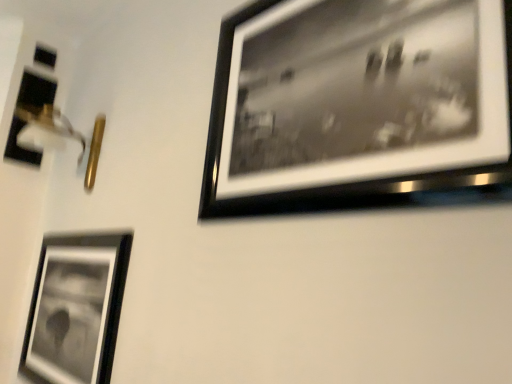
Measure the distance between point (64, 309) and camera.

The depth of point (64, 309) is 5.35 feet.

Find the location of a particular element. black matte picture frame at upper right, arranged as the 3th picture frame when viewed from the left is located at coordinates (357, 103).

Which of these two, matte black picture frame at left, arranged as the first picture frame when viewed from the back, or metallic silver frame at lower left, placed as the second picture frame when sorted from left to right, is thinner?

metallic silver frame at lower left, placed as the second picture frame when sorted from left to right, is thinner.

What are the coordinates of `the 2nd picture frame positioned above the metallic silver frame at lower left, marked as the second picture frame in a back-to-front arrangement (from a real-world perspective)` in the screenshot? It's located at (36, 91).

Which object is further away from the camera taking this photo, matte black picture frame at left, arranged as the 1th picture frame when viewed from the left, or metallic silver frame at lower left, placed as the second picture frame when sorted from left to right?

matte black picture frame at left, arranged as the 1th picture frame when viewed from the left, is more distant.

Consider the image. Is metallic silver frame at lower left, positioned as the second picture frame in right-to-left order, inside black matte picture frame at upper right, the 1th picture frame viewed from the right?

No, metallic silver frame at lower left, positioned as the second picture frame in right-to-left order, is not inside black matte picture frame at upper right, the 1th picture frame viewed from the right.

Looking at the image, does black matte picture frame at upper right, which ranks as the first picture frame in front-to-back order, seem bigger or smaller compared to metallic silver frame at lower left, placed as the second picture frame when sorted from left to right?

In the image, black matte picture frame at upper right, which ranks as the first picture frame in front-to-back order, appears to be smaller than metallic silver frame at lower left, placed as the second picture frame when sorted from left to right.

Measure the distance between black matte picture frame at upper right, arranged as the 3th picture frame when viewed from the left, and metallic silver frame at lower left, the second picture frame when ordered from front to back.

black matte picture frame at upper right, arranged as the 3th picture frame when viewed from the left, and metallic silver frame at lower left, the second picture frame when ordered from front to back, are 83.78 centimeters apart from each other.

Is black matte picture frame at upper right, arranged as the 3th picture frame when viewed from the left, facing towards metallic silver frame at lower left, marked as the second picture frame in a back-to-front arrangement?

No, black matte picture frame at upper right, arranged as the 3th picture frame when viewed from the left, is not aimed at metallic silver frame at lower left, marked as the second picture frame in a back-to-front arrangement.

How many degrees apart are the facing directions of matte black picture frame at left, positioned as the third picture frame in front-to-back order, and black matte picture frame at upper right, which ranks as the third picture frame in back-to-front order?

They differ by 88.5 degrees in their facing directions.

Is matte black picture frame at left, the third picture frame viewed from the right, spatially inside black matte picture frame at upper right, arranged as the 3th picture frame when viewed from the left, or outside of it?

matte black picture frame at left, the third picture frame viewed from the right, is not enclosed by black matte picture frame at upper right, arranged as the 3th picture frame when viewed from the left.

Between point (34, 162) and point (445, 155), which one is positioned behind?

Point (34, 162)

Identify the location of the 2nd picture frame behind the black matte picture frame at upper right, which ranks as the third picture frame in back-to-front order. (36, 91).

Is metallic silver frame at lower left, positioned as the second picture frame in right-to-left order, spatially inside matte black picture frame at left, the third picture frame viewed from the right, or outside of it?

metallic silver frame at lower left, positioned as the second picture frame in right-to-left order, is outside matte black picture frame at left, the third picture frame viewed from the right.

Find the location of `picture frame to the left of metallic silver frame at lower left, placed as the second picture frame when sorted from left to right`. picture frame to the left of metallic silver frame at lower left, placed as the second picture frame when sorted from left to right is located at coordinates (36, 91).

From a real-world perspective, is metallic silver frame at lower left, placed as the second picture frame when sorted from left to right, positioned above or below matte black picture frame at left, arranged as the 1th picture frame when viewed from the left?

metallic silver frame at lower left, placed as the second picture frame when sorted from left to right, is situated lower than matte black picture frame at left, arranged as the 1th picture frame when viewed from the left, in the real world.

Is metallic silver frame at lower left, placed as the second picture frame when sorted from left to right, positioned before matte black picture frame at left, arranged as the 1th picture frame when viewed from the left?

Yes, metallic silver frame at lower left, placed as the second picture frame when sorted from left to right, is closer to the camera.

Considering the relative sizes of metallic silver frame at lower left, the second picture frame when ordered from front to back, and black matte picture frame at upper right, which ranks as the third picture frame in back-to-front order, in the image provided, is metallic silver frame at lower left, the second picture frame when ordered from front to back, shorter than black matte picture frame at upper right, which ranks as the third picture frame in back-to-front order,?

Indeed, metallic silver frame at lower left, the second picture frame when ordered from front to back, has a lesser height compared to black matte picture frame at upper right, which ranks as the third picture frame in back-to-front order.

From a real-world perspective, who is located lower, metallic silver frame at lower left, positioned as the second picture frame in right-to-left order, or black matte picture frame at upper right, which ranks as the first picture frame in front-to-back order?

From a 3D spatial view, metallic silver frame at lower left, positioned as the second picture frame in right-to-left order, is below.

This screenshot has width=512, height=384. What are the coordinates of `picture frame below the black matte picture frame at upper right, which ranks as the third picture frame in back-to-front order (from a real-world perspective)` in the screenshot? It's located at (76, 308).

Are metallic silver frame at lower left, positioned as the second picture frame in right-to-left order, and black matte picture frame at upper right, which ranks as the first picture frame in front-to-back order, located far from each other?

metallic silver frame at lower left, positioned as the second picture frame in right-to-left order, is actually quite close to black matte picture frame at upper right, which ranks as the first picture frame in front-to-back order.

From the image's perspective, is black matte picture frame at upper right, which ranks as the first picture frame in front-to-back order, above or below matte black picture frame at left, positioned as the third picture frame in front-to-back order?

From the image's perspective, black matte picture frame at upper right, which ranks as the first picture frame in front-to-back order, appears below matte black picture frame at left, positioned as the third picture frame in front-to-back order.

Is black matte picture frame at upper right, arranged as the 3th picture frame when viewed from the left, turned away from matte black picture frame at left, the third picture frame viewed from the right?

black matte picture frame at upper right, arranged as the 3th picture frame when viewed from the left, does not have its back to matte black picture frame at left, the third picture frame viewed from the right.

Measure the distance from black matte picture frame at upper right, arranged as the 3th picture frame when viewed from the left, to matte black picture frame at left, the third picture frame viewed from the right.

black matte picture frame at upper right, arranged as the 3th picture frame when viewed from the left, and matte black picture frame at left, the third picture frame viewed from the right, are 1.68 meters apart.

Is matte black picture frame at left, the third picture frame viewed from the right, located within black matte picture frame at upper right, which ranks as the third picture frame in back-to-front order?

→ That's incorrect, matte black picture frame at left, the third picture frame viewed from the right, is not inside black matte picture frame at upper right, which ranks as the third picture frame in back-to-front order.

This screenshot has width=512, height=384. Identify the location of picture frame that is the 1st object to the right of the matte black picture frame at left, positioned as the third picture frame in front-to-back order, starting at the anchor. (76, 308).

Locate an element on the screen. This screenshot has width=512, height=384. picture frame below the black matte picture frame at upper right, which ranks as the third picture frame in back-to-front order (from the image's perspective) is located at coordinates (76, 308).

Based on their spatial positions, is matte black picture frame at left, arranged as the first picture frame when viewed from the back, or black matte picture frame at upper right, arranged as the 3th picture frame when viewed from the left, closer to metallic silver frame at lower left, marked as the second picture frame in a back-to-front arrangement?

Among the two, black matte picture frame at upper right, arranged as the 3th picture frame when viewed from the left, is located nearer to metallic silver frame at lower left, marked as the second picture frame in a back-to-front arrangement.

Based on their spatial positions, is metallic silver frame at lower left, positioned as the second picture frame in right-to-left order, or black matte picture frame at upper right, arranged as the 3th picture frame when viewed from the left, further from matte black picture frame at left, positioned as the third picture frame in front-to-back order?

black matte picture frame at upper right, arranged as the 3th picture frame when viewed from the left.

Estimate the real-world distances between objects in this image. Which object is further from black matte picture frame at upper right, which ranks as the third picture frame in back-to-front order, metallic silver frame at lower left, marked as the second picture frame in a back-to-front arrangement, or matte black picture frame at left, the third picture frame viewed from the right?

The object further to black matte picture frame at upper right, which ranks as the third picture frame in back-to-front order, is matte black picture frame at left, the third picture frame viewed from the right.

Based on their spatial positions, is matte black picture frame at left, the third picture frame viewed from the right, or metallic silver frame at lower left, the second picture frame when ordered from front to back, closer to black matte picture frame at upper right, arranged as the 3th picture frame when viewed from the left?

metallic silver frame at lower left, the second picture frame when ordered from front to back.

From the picture: When comparing their distances from metallic silver frame at lower left, placed as the second picture frame when sorted from left to right, does black matte picture frame at upper right, which ranks as the first picture frame in front-to-back order, or matte black picture frame at left, arranged as the 1th picture frame when viewed from the left, seem closer?

Among the two, black matte picture frame at upper right, which ranks as the first picture frame in front-to-back order, is located nearer to metallic silver frame at lower left, placed as the second picture frame when sorted from left to right.

When comparing their distances from matte black picture frame at left, positioned as the third picture frame in front-to-back order, does black matte picture frame at upper right, arranged as the 3th picture frame when viewed from the left, or metallic silver frame at lower left, positioned as the second picture frame in right-to-left order, seem closer?

metallic silver frame at lower left, positioned as the second picture frame in right-to-left order, is positioned closer to the anchor matte black picture frame at left, positioned as the third picture frame in front-to-back order.

Image resolution: width=512 pixels, height=384 pixels. I want to click on picture frame between black matte picture frame at upper right, the 1th picture frame viewed from the right, and matte black picture frame at left, arranged as the 1th picture frame when viewed from the left, along the z-axis, so click(76, 308).